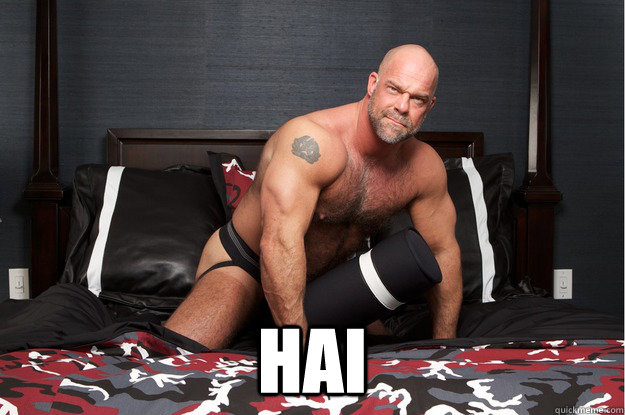
Locate an element on the screen. The image size is (625, 415). left white stripe on pillow is located at coordinates (112, 179).